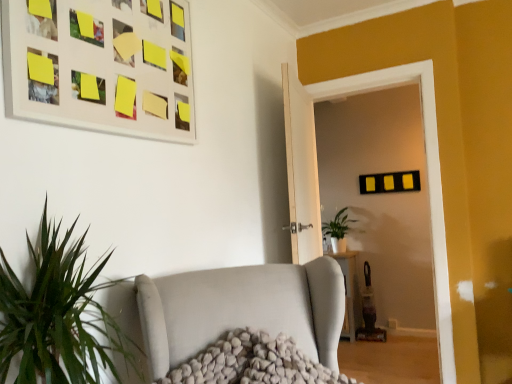
Question: From a real-world perspective, is matte black glass door at center physically located above or below green matte plant at center?

Choices:
 (A) above
 (B) below

Answer: (A)

Question: Considering the positions of matte black glass door at center and green matte plant at center in the image, is matte black glass door at center bigger or smaller than green matte plant at center?

Choices:
 (A) small
 (B) big

Answer: (B)

Question: Estimate the real-world distances between objects in this image. Which object is closer to the matte black glass door at center?

Choices:
 (A) matte white picture frame at upper left
 (B) white textured studio couch at center
 (C) green matte plant at center

Answer: (B)

Question: Which is farther from the green matte plant at center?

Choices:
 (A) white textured studio couch at center
 (B) matte white picture frame at upper left
 (C) matte black glass door at center

Answer: (B)